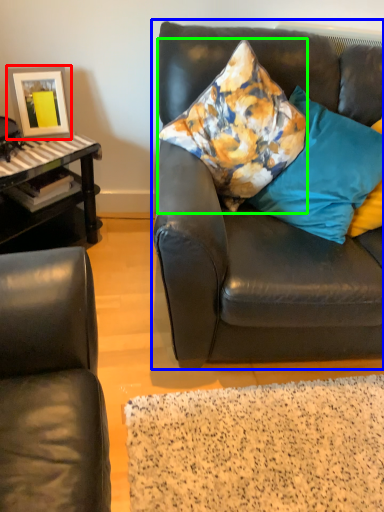
Question: Which object is the farthest from picture frame (highlighted by a red box)? Choose among these: studio couch (highlighted by a blue box) or pillow (highlighted by a green box).

Choices:
 (A) studio couch
 (B) pillow

Answer: (A)